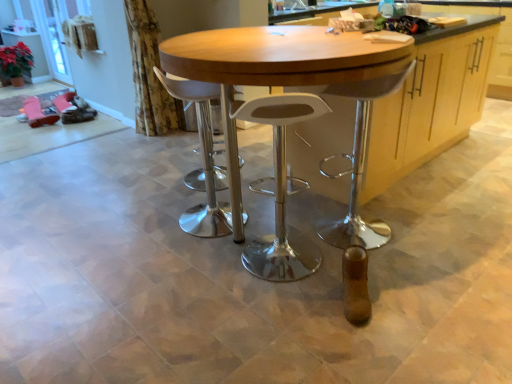
Question: Is wooden cabinet at center to the left of wooden table at center from the viewer's perspective?

Choices:
 (A) no
 (B) yes

Answer: (A)

Question: Is wooden cabinet at center oriented away from wooden table at center?

Choices:
 (A) yes
 (B) no

Answer: (B)

Question: Can you confirm if wooden cabinet at center is taller than wooden table at center?

Choices:
 (A) yes
 (B) no

Answer: (B)

Question: Can you confirm if wooden cabinet at center is bigger than wooden table at center?

Choices:
 (A) yes
 (B) no

Answer: (B)

Question: From a real-world perspective, does wooden cabinet at center stand above wooden table at center?

Choices:
 (A) yes
 (B) no

Answer: (B)

Question: Can you confirm if wooden cabinet at center is positioned to the right of wooden table at center?

Choices:
 (A) yes
 (B) no

Answer: (A)

Question: Considering the relative sizes of clear glass screen door at upper left and floral fabric curtain at upper left in the image provided, is clear glass screen door at upper left thinner than floral fabric curtain at upper left?

Choices:
 (A) no
 (B) yes

Answer: (B)

Question: Is floral fabric curtain at upper left surrounded by clear glass screen door at upper left?

Choices:
 (A) no
 (B) yes

Answer: (A)

Question: Can we say clear glass screen door at upper left lies outside floral fabric curtain at upper left?

Choices:
 (A) yes
 (B) no

Answer: (A)

Question: From the image's perspective, would you say clear glass screen door at upper left is positioned over floral fabric curtain at upper left?

Choices:
 (A) yes
 (B) no

Answer: (A)

Question: From a real-world perspective, does clear glass screen door at upper left sit lower than floral fabric curtain at upper left?

Choices:
 (A) yes
 (B) no

Answer: (A)

Question: Is there a large distance between clear glass screen door at upper left and floral fabric curtain at upper left?

Choices:
 (A) no
 (B) yes

Answer: (B)

Question: From the image's perspective, is floral fabric curtain at upper left on top of wooden table at center?

Choices:
 (A) no
 (B) yes

Answer: (B)